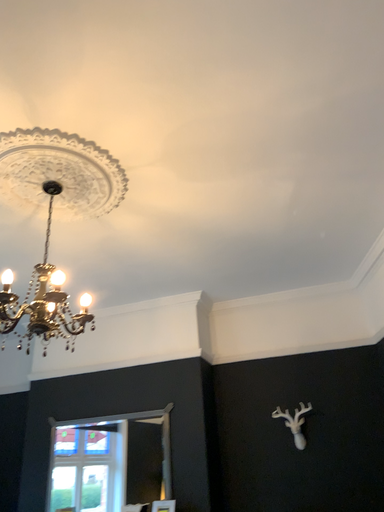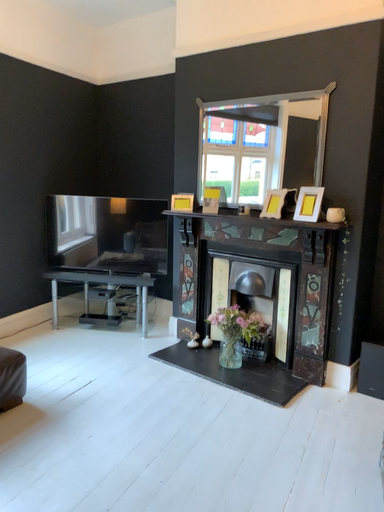
Question: How did the camera likely rotate when shooting the video?

Choices:
 (A) rotated upward
 (B) rotated downward

Answer: (B)